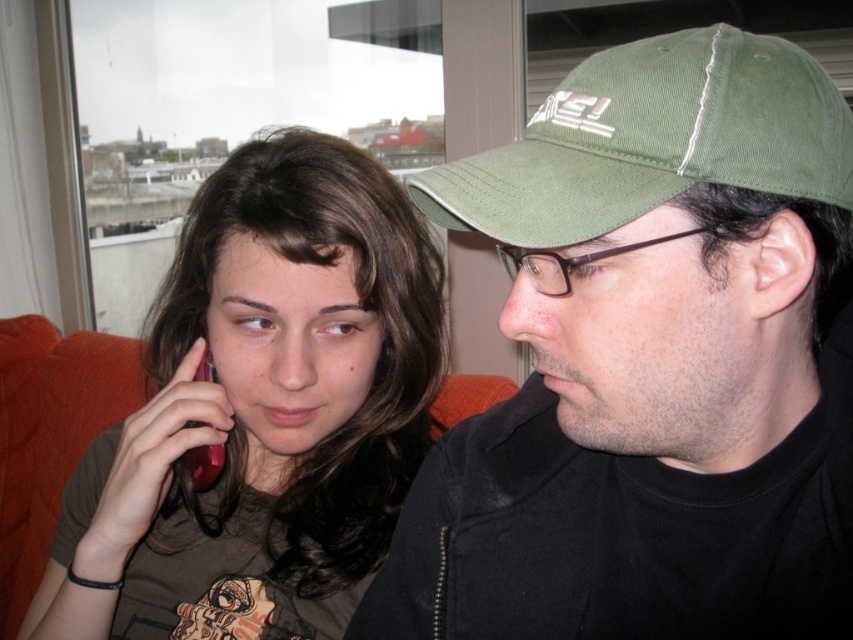
Question: Based on their relative distances, which object is farther from the green fabric baseball cap at upper right?

Choices:
 (A) green fabric cap at upper right
 (B) matte pink phone at left
 (C) matte black phone at left
 (D) skinny green cap at right

Answer: (B)

Question: Which point is farther from the camera taking this photo?

Choices:
 (A) (596, 353)
 (B) (795, 276)
 (C) (408, 227)

Answer: (C)

Question: Does matte black phone at left appear under skinny green cap at right?

Choices:
 (A) yes
 (B) no

Answer: (A)

Question: Does matte black phone at left have a smaller size compared to skinny green cap at right?

Choices:
 (A) yes
 (B) no

Answer: (B)

Question: Which of the following is the farthest from the observer?

Choices:
 (A) (718, 550)
 (B) (207, 376)
 (C) (407, 276)
 (D) (746, 100)

Answer: (B)

Question: Does green fabric cap at upper right have a smaller size compared to skinny green cap at right?

Choices:
 (A) no
 (B) yes

Answer: (A)